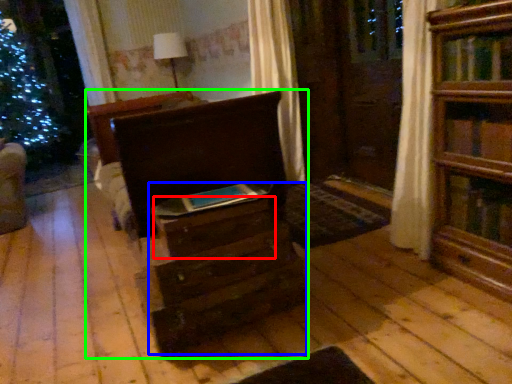
Question: Which object is positioned closest to drawer (highlighted by a red box)? Select from drawer (highlighted by a blue box) and chest of drawers (highlighted by a green box).

Choices:
 (A) drawer
 (B) chest of drawers

Answer: (A)